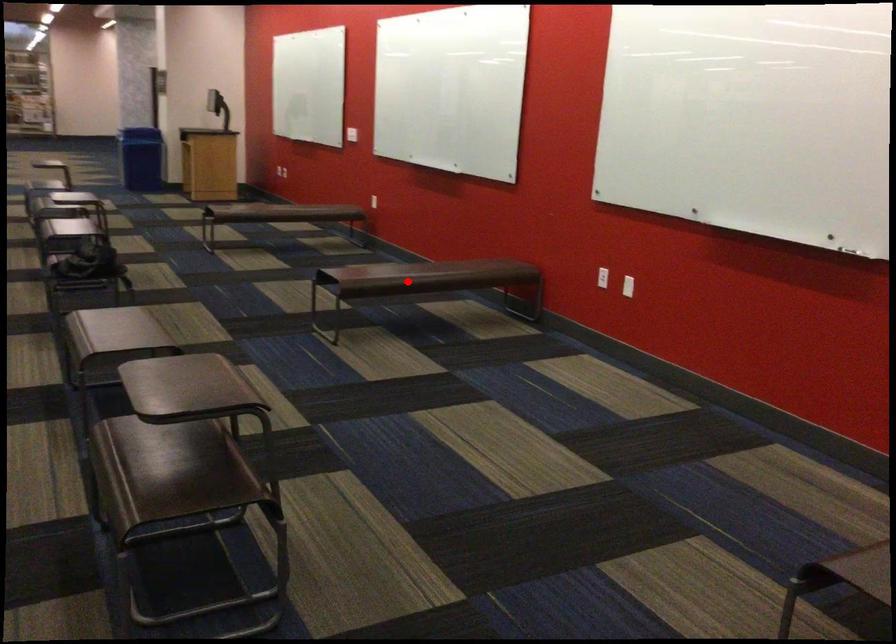
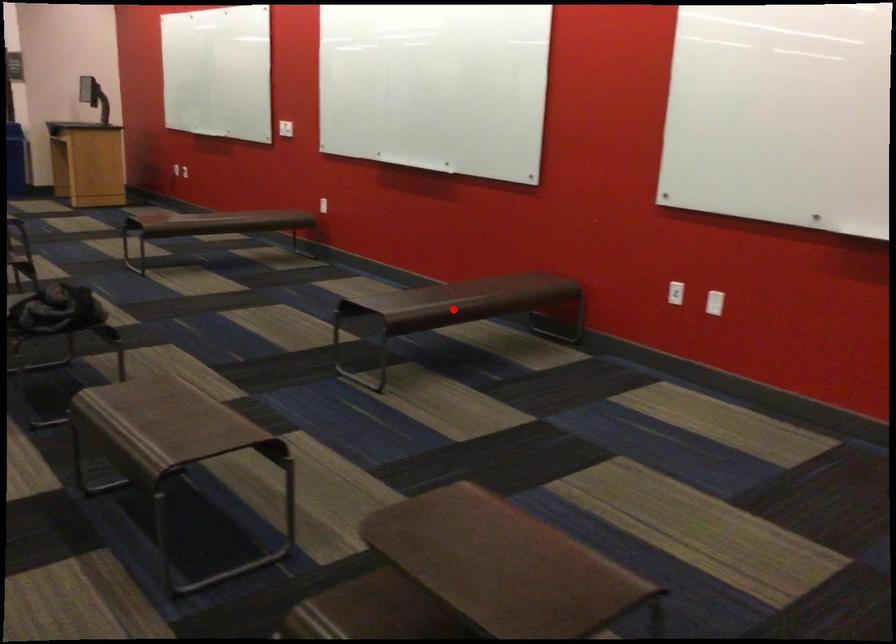
I am providing you with two images of the same scene from different viewpoints. A red point is marked on the first image and another point is marked on the second image. Is the marked point in image1 the same physical position as the marked point in image2?

Yes